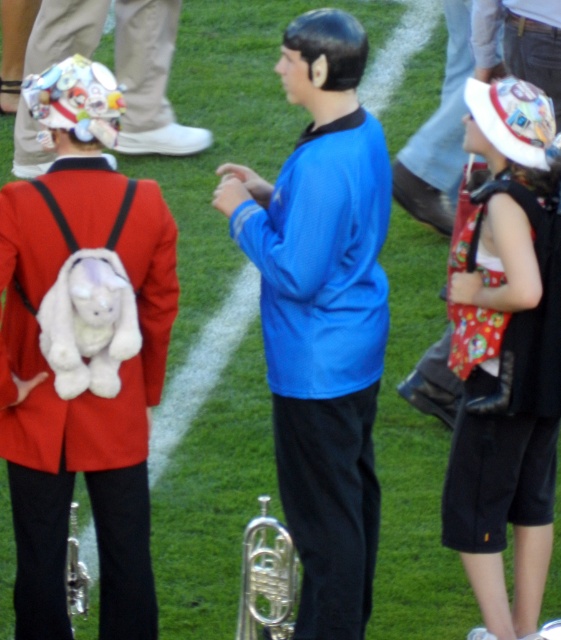
You are organizing an outdoor event and need to arrange items on a shelf. The shelf has a maximum width capacity of 50 cm. You have the white plush toy at left and the silver metallic trumpet at center. Based on their sizes, which item can safely be placed on the shelf without exceeding the width limit?

The silver metallic trumpet at center can safely be placed on the shelf since its width is smaller than the white plush toy at left, which exceeds the 50 cm limit.